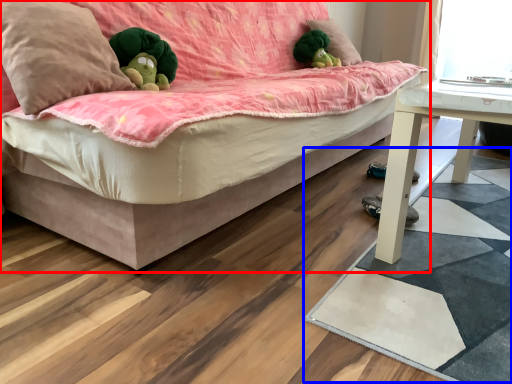
Question: Which object is closer to the camera taking this photo, studio couch (highlighted by a red box) or mat (highlighted by a blue box)?

Choices:
 (A) studio couch
 (B) mat

Answer: (A)